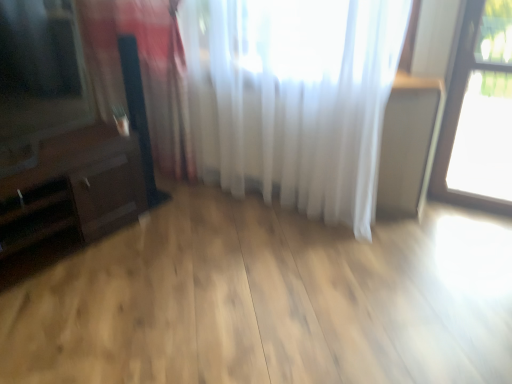
Locate an element on the screen. The height and width of the screenshot is (384, 512). vacant area that is in front of dark brown wood dresser at left is located at coordinates (70, 313).